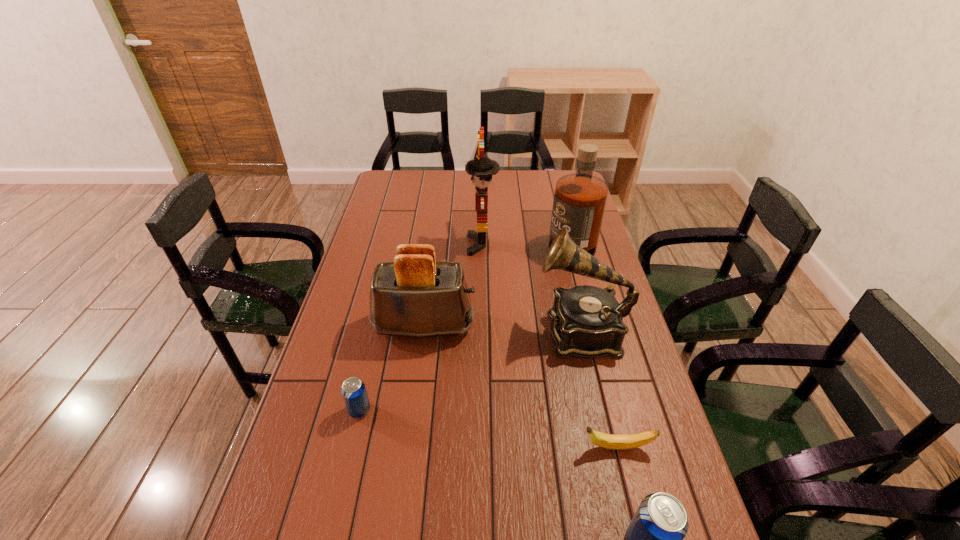
Identify the location of the left beer can. This screenshot has height=540, width=960. (353, 390).

Locate an element on the screen. Image resolution: width=960 pixels, height=540 pixels. the third nearest object is located at coordinates [353, 390].

The height and width of the screenshot is (540, 960). Find the location of `phonograph record`. phonograph record is located at coordinates (587, 322).

In order to click on liquor in this screenshot , I will do `click(580, 198)`.

Where is `nutcracker`? nutcracker is located at coordinates (x=482, y=168).

This screenshot has width=960, height=540. Find the location of `the fourth shortest object`. the fourth shortest object is located at coordinates (415, 296).

Identify the location of the shortest object. (628, 441).

Image resolution: width=960 pixels, height=540 pixels. I want to click on banana, so click(x=628, y=441).

Identify the location of free space located on the right of the farther beer can. Image resolution: width=960 pixels, height=540 pixels. (464, 410).

You are a GUI agent. You are given a task and a screenshot of the screen. Output one action in this format:
    pyautogui.click(x=<x>, y=<y>)
    Task: Click on the free region located on the horn of the phonograph record
    
    Given the screenshot: What is the action you would take?
    pyautogui.click(x=461, y=330)